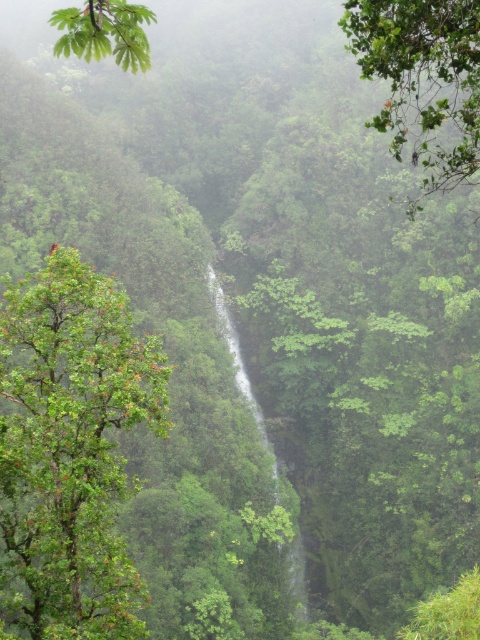
Question: Can you confirm if green leafy tree at left is positioned to the left of green leafy tree at upper left?

Choices:
 (A) no
 (B) yes

Answer: (B)

Question: Among these objects, which one is farthest from the camera?

Choices:
 (A) green leafy tree at upper left
 (B) green leafy tree at left

Answer: (B)

Question: Does green leafy tree at left have a smaller size compared to green leafy tree at upper left?

Choices:
 (A) no
 (B) yes

Answer: (A)

Question: Among these objects, which one is farthest from the camera?

Choices:
 (A) green leafy tree at upper left
 (B) green leafy tree at upper center
 (C) green leafy tree at left

Answer: (C)

Question: Considering the real-world distances, which object is farthest from the green leafy tree at left?

Choices:
 (A) green leafy tree at upper left
 (B) green leafy tree at upper center

Answer: (B)

Question: Is green leafy tree at left wider than green leafy tree at upper center?

Choices:
 (A) yes
 (B) no

Answer: (B)